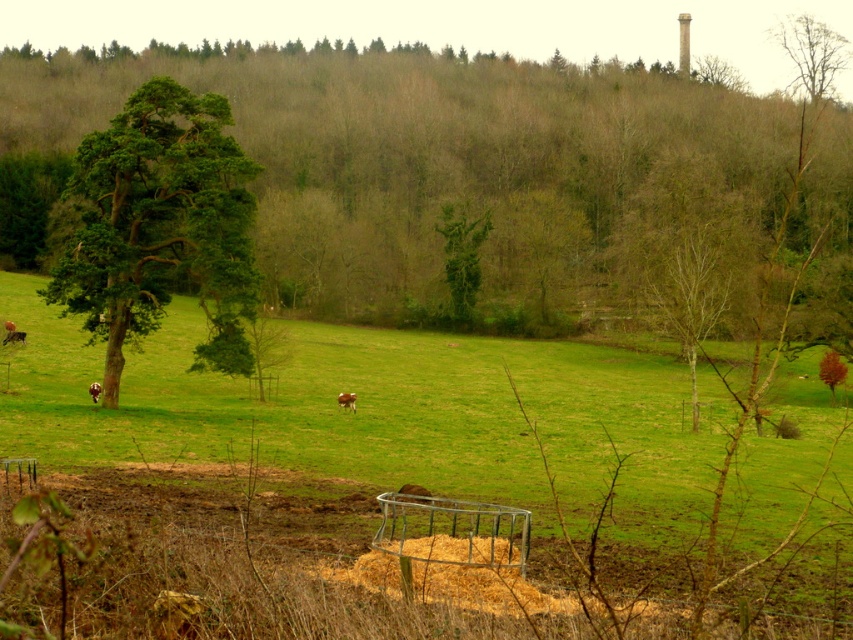
Question: Which object is the farthest from the green grass at center?

Choices:
 (A) green matte tree at center
 (B) brown furry cow at center

Answer: (A)

Question: Considering the relative positions of brown leafy tree at upper right and smooth brown tree at right in the image provided, where is brown leafy tree at upper right located with respect to smooth brown tree at right?

Choices:
 (A) right
 (B) left

Answer: (A)

Question: From the image, what is the correct spatial relationship of brown leafy tree at upper right in relation to brown furry cow at left?

Choices:
 (A) below
 (B) above

Answer: (B)

Question: Can you confirm if bare wood tree at right is smaller than brown leafy tree at upper right?

Choices:
 (A) yes
 (B) no

Answer: (A)

Question: Which of the following is the farthest from the observer?

Choices:
 (A) (630, 451)
 (B) (134, 268)
 (C) (819, 76)
 (D) (442, 225)

Answer: (C)

Question: Which object appears closest to the camera in this image?

Choices:
 (A) brown furry cow at center
 (B) brown leafy tree at upper right
 (C) green matte tree at center

Answer: (A)